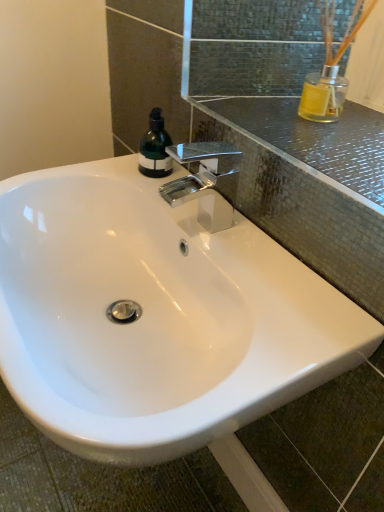
Question: Is polished chrome faucet at upper center touching green matte bottle at upper left?

Choices:
 (A) no
 (B) yes

Answer: (B)

Question: Is polished chrome faucet at upper center turned away from green matte bottle at upper left?

Choices:
 (A) no
 (B) yes

Answer: (A)

Question: Is polished chrome faucet at upper center thinner than green matte bottle at upper left?

Choices:
 (A) no
 (B) yes

Answer: (A)

Question: Is polished chrome faucet at upper center far from green matte bottle at upper left?

Choices:
 (A) yes
 (B) no

Answer: (B)

Question: From a real-world perspective, is polished chrome faucet at upper center on top of green matte bottle at upper left?

Choices:
 (A) yes
 (B) no

Answer: (A)

Question: Would you say polished chrome faucet at upper center contains green matte bottle at upper left?

Choices:
 (A) yes
 (B) no

Answer: (B)

Question: Is transparent glass mirror at upper center further to camera compared to green matte bottle at upper left?

Choices:
 (A) yes
 (B) no

Answer: (B)

Question: Can we say transparent glass mirror at upper center lies outside green matte bottle at upper left?

Choices:
 (A) yes
 (B) no

Answer: (A)

Question: Considering the relative sizes of transparent glass mirror at upper center and green matte bottle at upper left in the image provided, is transparent glass mirror at upper center smaller than green matte bottle at upper left?

Choices:
 (A) yes
 (B) no

Answer: (B)

Question: Does transparent glass mirror at upper center have a lesser height compared to green matte bottle at upper left?

Choices:
 (A) no
 (B) yes

Answer: (B)

Question: Can you confirm if transparent glass mirror at upper center is taller than green matte bottle at upper left?

Choices:
 (A) no
 (B) yes

Answer: (A)

Question: Is transparent glass mirror at upper center to the right of green matte bottle at upper left from the viewer's perspective?

Choices:
 (A) yes
 (B) no

Answer: (A)

Question: From a real-world perspective, is polished chrome faucet at upper center located beneath white glossy sink at center?

Choices:
 (A) no
 (B) yes

Answer: (A)